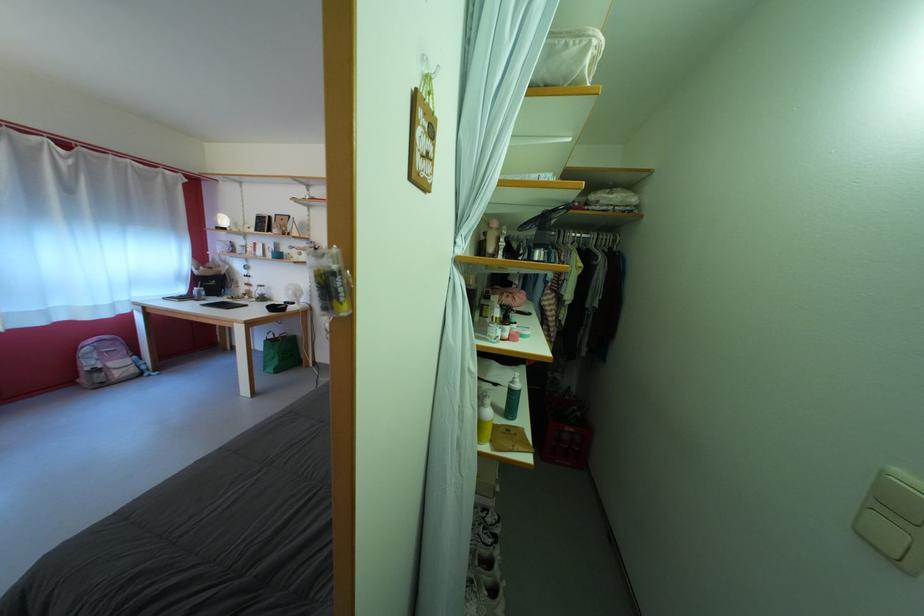
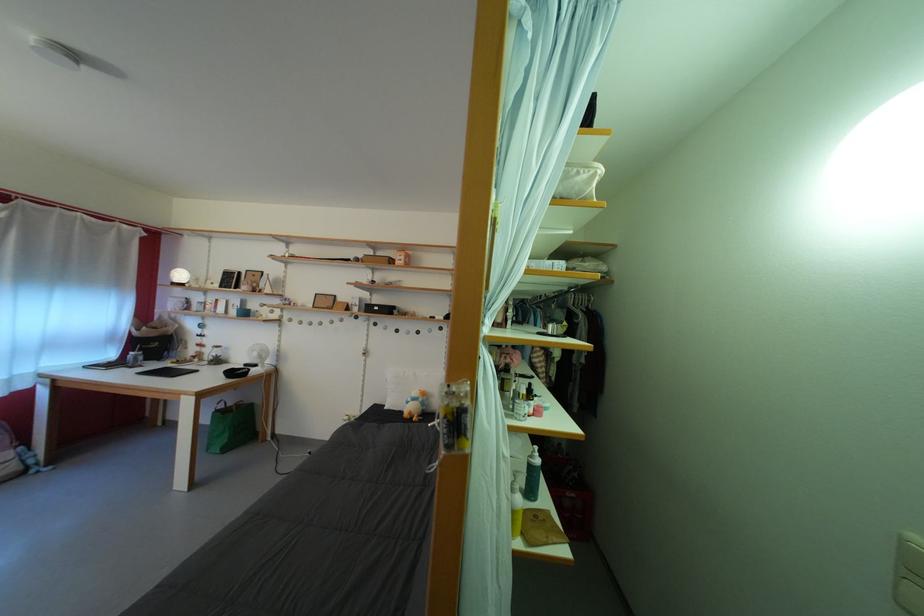
Question: Which direction would the cameraman need to move to produce the second image? Reply with the corresponding letter.

Choices:
 (A) Left
 (B) Right
 (C) Forward
 (D) Backward

Answer: (A)